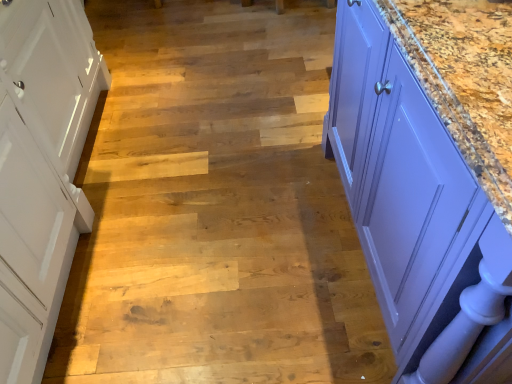
This screenshot has height=384, width=512. In order to click on free point above wooden stair at center (from a real-world perspective) in this screenshot , I will do `click(215, 108)`.